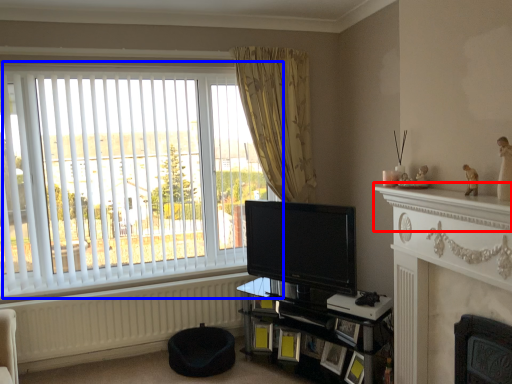
Question: Which object appears closest to the camera in this image, mantle (highlighted by a red box) or window (highlighted by a blue box)?

Choices:
 (A) mantle
 (B) window

Answer: (A)